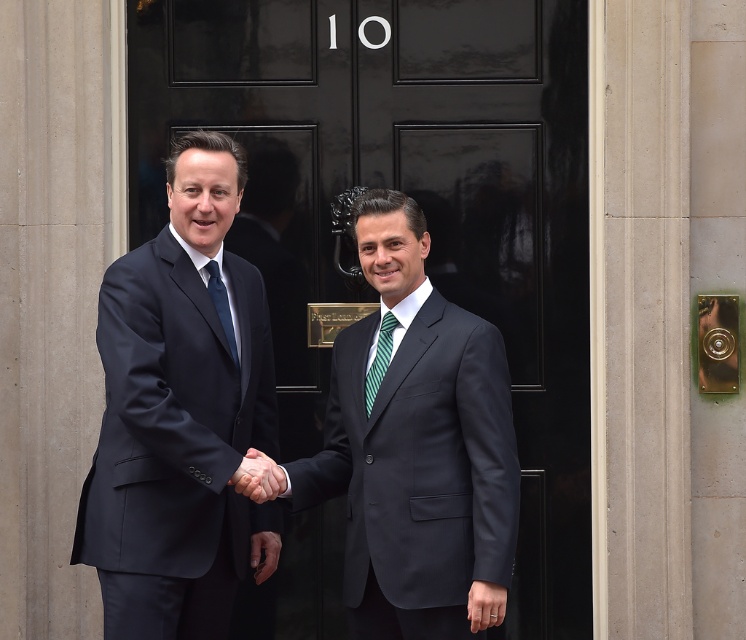
You are a photographer standing 5 feet away from the dark blue suit at center and the green striped tie at center. You want to take a picture of both items in focus. Since the distance between them is critical, can you confirm if they are within the 12 inches focus range of your camera lens?

The dark blue suit at center is 11.81 inches away from the green striped tie at center, so they are within the 12 inches focus range of your camera lens.

You are a security guard who needs to check the distance between the black glossy door at center and the matte black tie at center. The security protocol requires that this distance must be at least 1.5 meters for safety. Is the current distance compliant?

The distance between the black glossy door at center and the matte black tie at center is 1.56 meters, which is greater than the required 1.5 meters. Therefore, the distance is compliant with the security protocol.

You are a painter who needs to decide whether to use a wide brush or a narrow brush to paint the black glossy door at center and the matte black tie at center. Based on their sizes, which brush should you use for each object?

The black glossy door at center is wider than the matte black tie at center. Therefore, use a wide brush for the black glossy door at center and a narrow brush for the matte black tie at center.